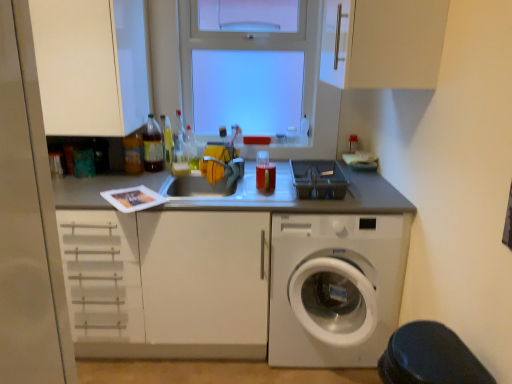
Locate an element on the screen. translucent plastic bottle at upper center, positioned as the third bottle in right-to-left order is located at coordinates (178, 139).

How much space does translucent plastic bottle at center, placed as the third bottle when sorted from left to right, occupy horizontally?

3.10 inches.

Measure the distance between white matte cabinet at center, the second cabinetry positioned from the left, and camera.

They are 6.08 feet apart.

What do you see at coordinates (190, 149) in the screenshot? The height and width of the screenshot is (384, 512). I see `translucent plastic bottle at center, the second bottle viewed from the right` at bounding box center [190, 149].

In order to click on translucent plastic bottle at upper center, positioned as the third bottle in right-to-left order in this screenshot , I will do (178, 139).

You are a GUI agent. You are given a task and a screenshot of the screen. Output one action in this format:
    pyautogui.click(x=<x>, y=<y>)
    Task: Click on the 1st bottle to the right of the matte white cabinet at upper left, which is counted as the 1th cabinetry, starting from the left, starting your count from the anchor
    The height and width of the screenshot is (384, 512).
    Given the screenshot: What is the action you would take?
    pyautogui.click(x=133, y=154)

From the image's perspective, is translucent plastic bottle at left, the first bottle positioned from the left, located above or below matte white cabinet at upper left, which is the 3th cabinetry from right to left?

From the image's perspective, translucent plastic bottle at left, the first bottle positioned from the left, appears below matte white cabinet at upper left, which is the 3th cabinetry from right to left.

Can you see translucent plastic bottle at left, which ranks as the 6th bottle in right-to-left order, touching matte white cabinet at upper left, which is counted as the 1th cabinetry, starting from the left?

No, translucent plastic bottle at left, which ranks as the 6th bottle in right-to-left order, is not next to matte white cabinet at upper left, which is counted as the 1th cabinetry, starting from the left.

Considering the sizes of translucent plastic bottle at left, the first bottle positioned from the left, and matte white cabinet at upper left, which is counted as the 1th cabinetry, starting from the left, in the image, is translucent plastic bottle at left, the first bottle positioned from the left, wider or thinner than matte white cabinet at upper left, which is counted as the 1th cabinetry, starting from the left,?

translucent plastic bottle at left, the first bottle positioned from the left, is thinner than matte white cabinet at upper left, which is counted as the 1th cabinetry, starting from the left.

Would you consider matte white cabinet at upper left, which is counted as the 1th cabinetry, starting from the left, to be distant from translucent plastic bottle at left, the first bottle positioned from the left?

No, there isn't a large distance between matte white cabinet at upper left, which is counted as the 1th cabinetry, starting from the left, and translucent plastic bottle at left, the first bottle positioned from the left.

Between matte white cabinet at upper left, which is counted as the 1th cabinetry, starting from the left, and translucent plastic bottle at left, which ranks as the 6th bottle in right-to-left order, which one has larger size?

matte white cabinet at upper left, which is counted as the 1th cabinetry, starting from the left, is bigger.

From the image's perspective, is matte white cabinet at upper left, which is the 3th cabinetry from right to left, on translucent plastic bottle at left, which ranks as the 6th bottle in right-to-left order?

Correct, matte white cabinet at upper left, which is the 3th cabinetry from right to left, appears higher than translucent plastic bottle at left, which ranks as the 6th bottle in right-to-left order, in the image.

Can you confirm if translucent plastic bottle at center, placed as the third bottle when sorted from left to right, is taller than translucent plastic bottle at center, which is the sixth bottle from left to right?

Yes, translucent plastic bottle at center, placed as the third bottle when sorted from left to right, is taller than translucent plastic bottle at center, which is the sixth bottle from left to right.

Relative to translucent plastic bottle at center, which ranks as the first bottle in right-to-left order, is translucent plastic bottle at center, placed as the third bottle when sorted from left to right, in front or behind?

In the image, translucent plastic bottle at center, placed as the third bottle when sorted from left to right, appears behind translucent plastic bottle at center, which ranks as the first bottle in right-to-left order.

From the picture: How far apart are translucent plastic bottle at center, placed as the third bottle when sorted from left to right, and translucent plastic bottle at center, which is the sixth bottle from left to right?

The distance of translucent plastic bottle at center, placed as the third bottle when sorted from left to right, from translucent plastic bottle at center, which is the sixth bottle from left to right, is 22.11 inches.

Is translucent plastic bottle at center, which is counted as the fourth bottle, starting from the right, positioned beyond the bounds of translucent plastic bottle at center, which is the sixth bottle from left to right?

Absolutely, translucent plastic bottle at center, which is counted as the fourth bottle, starting from the right, is external to translucent plastic bottle at center, which is the sixth bottle from left to right.

Between translucent plastic bottle at upper left, arranged as the 2th bottle when viewed from the left, and translucent plastic bottle at left, which ranks as the 6th bottle in right-to-left order, which one appears on the right side from the viewer's perspective?

From the viewer's perspective, translucent plastic bottle at upper left, arranged as the 2th bottle when viewed from the left, appears more on the right side.

Is translucent plastic bottle at upper left, the 5th bottle in the right-to-left sequence, bigger or smaller than translucent plastic bottle at left, the first bottle positioned from the left?

In the image, translucent plastic bottle at upper left, the 5th bottle in the right-to-left sequence, appears to be larger than translucent plastic bottle at left, the first bottle positioned from the left.

Between translucent plastic bottle at upper left, arranged as the 2th bottle when viewed from the left, and translucent plastic bottle at left, which ranks as the 6th bottle in right-to-left order, which one has more height?

Standing taller between the two is translucent plastic bottle at upper left, arranged as the 2th bottle when viewed from the left.

Is translucent plastic bottle at upper left, arranged as the 2th bottle when viewed from the left, far from translucent plastic bottle at left, the first bottle positioned from the left?

No, translucent plastic bottle at upper left, arranged as the 2th bottle when viewed from the left, is not far from translucent plastic bottle at left, the first bottle positioned from the left.

Consider the image. Is translucent plastic bottle at upper center, which appears as the fourth bottle when viewed from the left, smaller than translucent plastic bottle at upper left, the 5th bottle in the right-to-left sequence?

Yes.

Between translucent plastic bottle at upper center, which appears as the fourth bottle when viewed from the left, and translucent plastic bottle at upper left, arranged as the 2th bottle when viewed from the left, which one has smaller width?

translucent plastic bottle at upper left, arranged as the 2th bottle when viewed from the left, is thinner.

Between translucent plastic bottle at upper center, which appears as the fourth bottle when viewed from the left, and translucent plastic bottle at upper left, the 5th bottle in the right-to-left sequence, which one appears on the left side from the viewer's perspective?

translucent plastic bottle at upper left, the 5th bottle in the right-to-left sequence.

Is translucent plastic bottle at upper center, which appears as the fourth bottle when viewed from the left, looking in the opposite direction of translucent plastic bottle at upper left, the 5th bottle in the right-to-left sequence?

No.

Is translucent plastic bottle at center, which ranks as the first bottle in right-to-left order, wider than translucent plastic bottle at left, the first bottle positioned from the left?

Correct, the width of translucent plastic bottle at center, which ranks as the first bottle in right-to-left order, exceeds that of translucent plastic bottle at left, the first bottle positioned from the left.

Which of these two, translucent plastic bottle at center, which ranks as the first bottle in right-to-left order, or translucent plastic bottle at left, the first bottle positioned from the left, is bigger?

Bigger between the two is translucent plastic bottle at center, which ranks as the first bottle in right-to-left order.

From a real-world perspective, between translucent plastic bottle at center, which is the sixth bottle from left to right, and translucent plastic bottle at left, the first bottle positioned from the left, who is vertically higher?

In real-world perspective, translucent plastic bottle at left, the first bottle positioned from the left, is above.

Where is `bottle that is the 4th one when counting rightward from the white matte cabinet at center, which is counted as the second cabinetry, starting from the right`? The image size is (512, 384). bottle that is the 4th one when counting rightward from the white matte cabinet at center, which is counted as the second cabinetry, starting from the right is located at coordinates (190, 149).

Considering their positions, is white matte cabinet at center, which is counted as the second cabinetry, starting from the right, located in front of or behind translucent plastic bottle at center, which is the 5th bottle from left to right?

Visually, white matte cabinet at center, which is counted as the second cabinetry, starting from the right, is located in front of translucent plastic bottle at center, which is the 5th bottle from left to right.

From a real-world perspective, which is physically below, white matte cabinet at center, the second cabinetry positioned from the left, or translucent plastic bottle at center, which is the 5th bottle from left to right?

white matte cabinet at center, the second cabinetry positioned from the left, is physically lower.

Does point (82, 341) come in front of point (190, 162)?

Yes.

From the image's perspective, starting from the matte white cabinet at upper left, which is counted as the 1th cabinetry, starting from the left, which bottle is the 5th one below? Please provide its 2D coordinates.

[(133, 154)]

From a real-world perspective, starting from the translucent plastic bottle at left, the first bottle positioned from the left, which cabinetry is the 1st one vertically above it? Please provide its 2D coordinates.

[(92, 66)]

Based on their spatial positions, is black rubber step stool at lower right or translucent plastic bottle at center, which is the sixth bottle from left to right, further from white plastic washing machine at lower right?

Based on the image, black rubber step stool at lower right appears to be further to white plastic washing machine at lower right.

Estimate the real-world distances between objects in this image. Which object is closer to transparent glass window at upper center, white matte cabinet at center, the second cabinetry positioned from the left, or translucent plastic bottle at center, which is counted as the fourth bottle, starting from the right?

translucent plastic bottle at center, which is counted as the fourth bottle, starting from the right, is closer to transparent glass window at upper center.

Which object lies nearer to the anchor point gray plastic container at center, translucent plastic bottle at center, which is the sixth bottle from left to right, or matte white cabinet at upper left, which is the 3th cabinetry from right to left?

translucent plastic bottle at center, which is the sixth bottle from left to right, lies closer to gray plastic container at center than the other object.

Considering their positions, is translucent plastic bottle at center, which ranks as the first bottle in right-to-left order, positioned further to translucent plastic bottle at center, which is counted as the fourth bottle, starting from the right, than translucent plastic bottle at upper left, the 5th bottle in the right-to-left sequence?

translucent plastic bottle at center, which ranks as the first bottle in right-to-left order, is further to translucent plastic bottle at center, which is counted as the fourth bottle, starting from the right.

From the image, which object appears to be farther from white matte cabinet at upper center, which appears as the 3th cabinetry when viewed from the left, black rubber step stool at lower right or transparent glass window at upper center?

transparent glass window at upper center is further to white matte cabinet at upper center, which appears as the 3th cabinetry when viewed from the left.

Looking at the image, which one is located further to translucent plastic bottle at center, which ranks as the first bottle in right-to-left order, translucent plastic bottle at center, which is the 5th bottle from left to right, or translucent plastic bottle at left, the first bottle positioned from the left?

translucent plastic bottle at left, the first bottle positioned from the left, is positioned further to the anchor translucent plastic bottle at center, which ranks as the first bottle in right-to-left order.

Which object lies further to the anchor point translucent plastic bottle at center, which ranks as the first bottle in right-to-left order, black rubber step stool at lower right or translucent plastic bottle at center, which is counted as the fourth bottle, starting from the right?

Based on the image, black rubber step stool at lower right appears to be further to translucent plastic bottle at center, which ranks as the first bottle in right-to-left order.

From the image, which object appears to be nearer to translucent plastic bottle at center, the second bottle viewed from the right, translucent plastic bottle at upper center, positioned as the third bottle in right-to-left order, or gray plastic container at center?

Based on the image, translucent plastic bottle at upper center, positioned as the third bottle in right-to-left order, appears to be nearer to translucent plastic bottle at center, the second bottle viewed from the right.

Image resolution: width=512 pixels, height=384 pixels. What are the coordinates of `washing machine located between translucent plastic bottle at left, which ranks as the 6th bottle in right-to-left order, and black rubber step stool at lower right in the left-right direction` in the screenshot? It's located at (335, 288).

I want to click on washing machine between translucent plastic bottle at center, which is counted as the fourth bottle, starting from the right, and white matte cabinet at upper center, which appears as the 3th cabinetry when viewed from the left, so click(x=335, y=288).

Find the location of a particular element. This screenshot has width=512, height=384. appliance positioned between black rubber step stool at lower right and translucent plastic bottle at center, the second bottle viewed from the right, from near to far is located at coordinates (318, 179).

Where is `window screen located between white matte cabinet at upper center, which appears as the 3th cabinetry when viewed from the left, and translucent plastic bottle at upper center, positioned as the third bottle in right-to-left order, in the depth direction`? The height and width of the screenshot is (384, 512). window screen located between white matte cabinet at upper center, which appears as the 3th cabinetry when viewed from the left, and translucent plastic bottle at upper center, positioned as the third bottle in right-to-left order, in the depth direction is located at coordinates (247, 90).